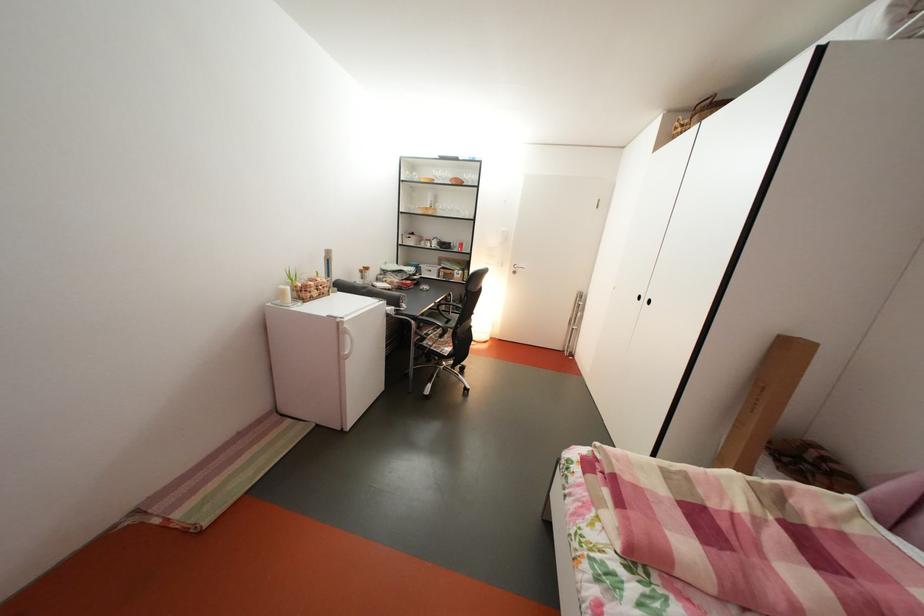
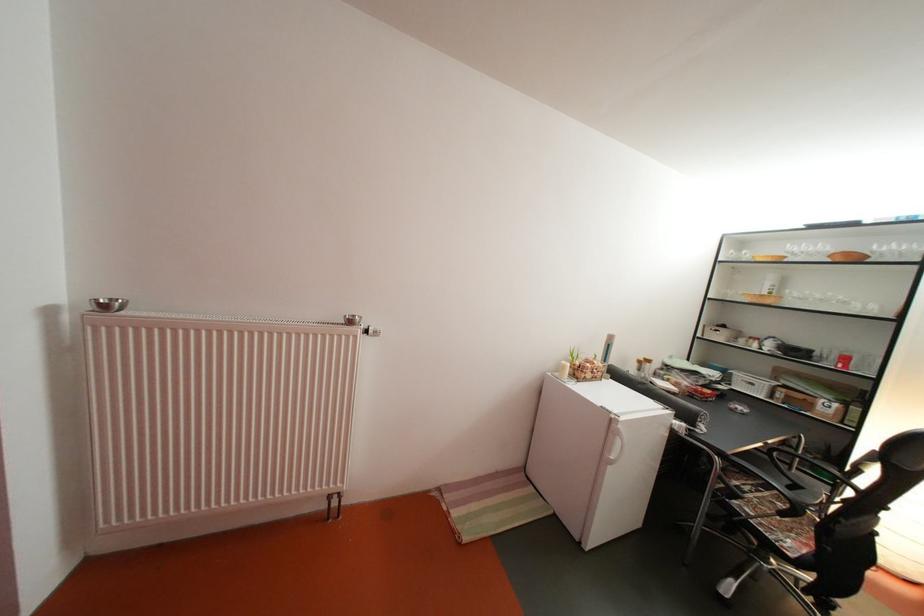
Question: How did the camera likely rotate?

Choices:
 (A) Left
 (B) Right
 (C) Up
 (D) Down

Answer: (A)